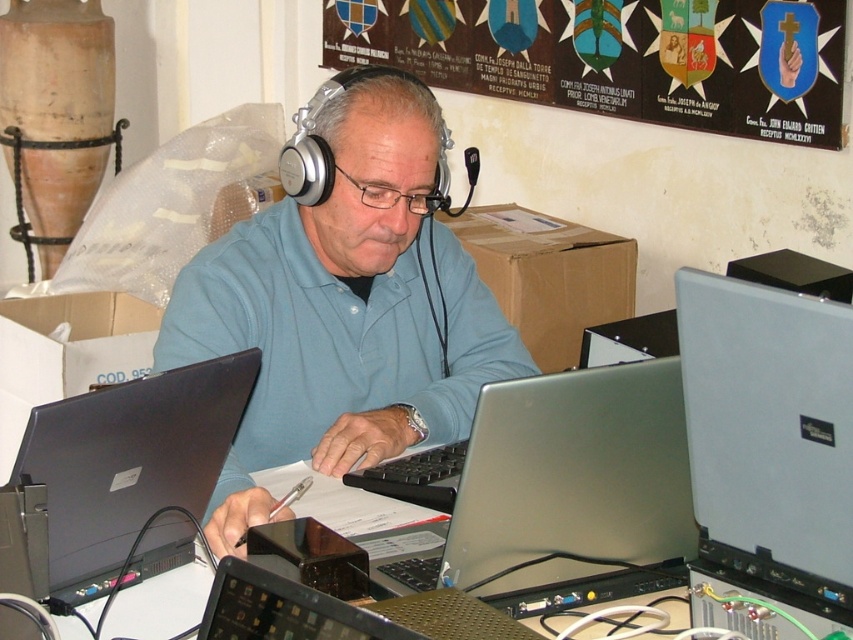
Between slate gray plastic case at right and black glossy laptop at center, which one is positioned lower?

black glossy laptop at center is lower down.

Between slate gray plastic case at right and black glossy laptop at center, which one has more height?

slate gray plastic case at right is taller.

Measure the distance between point (x=828, y=538) and camera.

They are 38.54 inches apart.

Locate an element on the screen. slate gray plastic case at right is located at coordinates (767, 456).

Can you confirm if silver metallic laptop at center is positioned to the right of matte black laptop at left?

Yes, silver metallic laptop at center is to the right of matte black laptop at left.

Can you confirm if silver metallic laptop at center is positioned to the left of matte black laptop at left?

No, silver metallic laptop at center is not to the left of matte black laptop at left.

Which is behind, point (549, 419) or point (155, 394)?

The point (155, 394) is more distant.

What are the coordinates of `silver metallic laptop at center` in the screenshot? It's located at (554, 493).

Is matte blue shirt at center above slate gray plastic case at right?

Yes, matte blue shirt at center is above slate gray plastic case at right.

Describe the element at coordinates (344, 308) in the screenshot. This screenshot has width=853, height=640. I see `matte blue shirt at center` at that location.

Where is `matte blue shirt at center`? matte blue shirt at center is located at coordinates (344, 308).